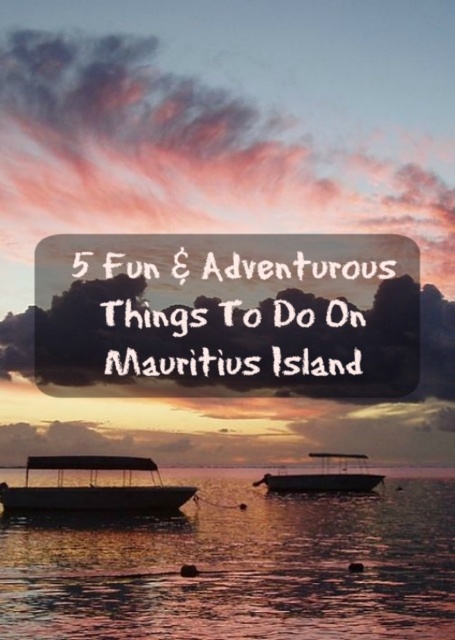
Does translucent water at center have a greater width compared to matte black boat at center?

Yes, translucent water at center is wider than matte black boat at center.

Can you confirm if translucent water at center is shorter than matte black boat at center?

No.

Where is `translucent water at center`? This screenshot has height=640, width=455. translucent water at center is located at coordinates (239, 566).

In order to click on translucent water at center in this screenshot , I will do `click(239, 566)`.

Where is `matte black boat at lower left`? matte black boat at lower left is located at coordinates (95, 486).

Is point (75, 492) positioned before point (283, 481)?

Yes, it is.

Which is in front, point (146, 486) or point (334, 481)?

Point (146, 486)

This screenshot has width=455, height=640. I want to click on matte black boat at lower left, so click(x=95, y=486).

Is translucent water at center wider than matte black boat at lower left?

Yes, translucent water at center is wider than matte black boat at lower left.

Which is behind, point (262, 577) or point (106, 497)?

The point (106, 497) is behind.

In order to click on translucent water at center in this screenshot , I will do `click(239, 566)`.